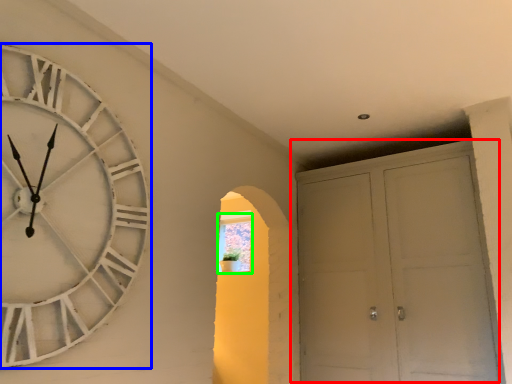
Question: Estimate the real-world distances between objects in this image. Which object is closer to door (highlighted by a red box), wall clock (highlighted by a blue box) or window (highlighted by a green box)?

Choices:
 (A) wall clock
 (B) window

Answer: (B)